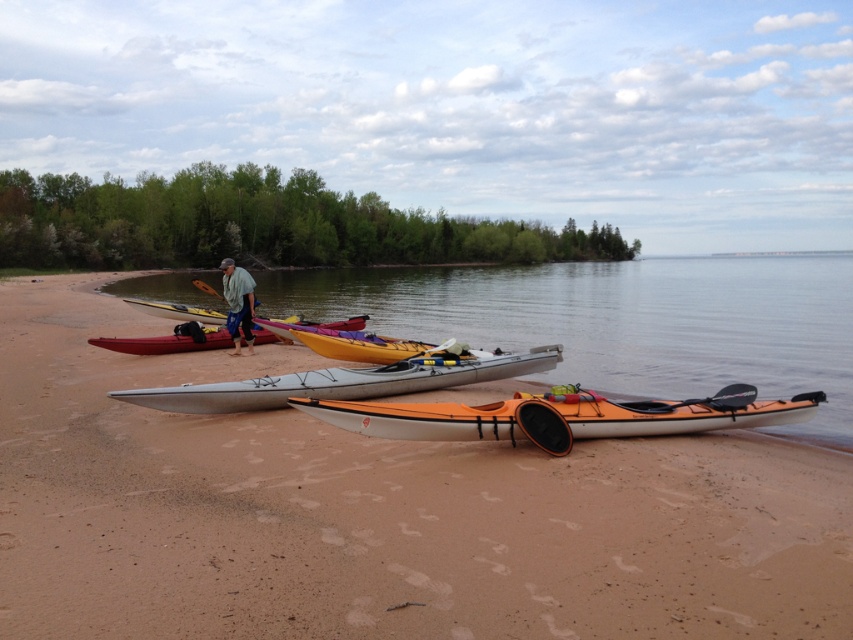
Does smooth brown sand at center appear on the right side of green cotton shirt at center?

Indeed, smooth brown sand at center is positioned on the right side of green cotton shirt at center.

Does smooth brown sand at center come behind green cotton shirt at center?

No, smooth brown sand at center is closer to the viewer.

Is point (485, 547) more distant than point (231, 266)?

No, (485, 547) is in front of (231, 266).

Find the location of a particular element. The width and height of the screenshot is (853, 640). smooth brown sand at center is located at coordinates (378, 513).

Is point (579, 285) behind point (502, 355)?

That is True.

Between point (566, 330) and point (241, 397), which one is positioned in front?

Positioned in front is point (241, 397).

The height and width of the screenshot is (640, 853). I want to click on orange kayak at center, so click(x=622, y=321).

Is orange matte kayak at center wider than silver metallic canoe at center?

Yes, orange matte kayak at center is wider than silver metallic canoe at center.

Is the position of orange matte kayak at center more distant than that of silver metallic canoe at center?

No, it is in front of silver metallic canoe at center.

Between point (451, 433) and point (242, 408), which one is positioned behind?

The point (242, 408) is behind.

Identify the location of orange matte kayak at center. (561, 417).